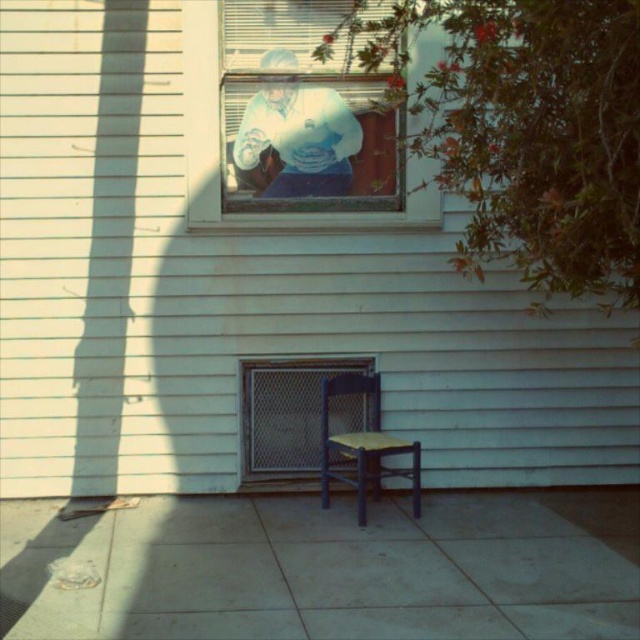
What do you see at coordinates (296, 141) in the screenshot? I see `white cotton shirt at upper center` at bounding box center [296, 141].

Is point (275, 124) positioned in front of point (348, 364)?

Yes, it is.

Identify the location of white cotton shirt at upper center. (x=296, y=141).

What do you see at coordinates (285, 416) in the screenshot? The height and width of the screenshot is (640, 640). I see `metal mesh door at lower center` at bounding box center [285, 416].

Measure the distance between metal mesh door at lower center and wooden chair at center.

They are 14.09 inches apart.

Is point (310, 404) farther from camera compared to point (340, 474)?

Yes, point (310, 404) is behind point (340, 474).

You are a GUI agent. You are given a task and a screenshot of the screen. Output one action in this format:
    pyautogui.click(x=<x>, y=<y>)
    Task: Click on the metal mesh door at lower center
    The height and width of the screenshot is (640, 640).
    Given the screenshot: What is the action you would take?
    pyautogui.click(x=285, y=416)

Is point (205, 147) behind point (257, 417)?

No, (205, 147) is closer to viewer.

Is clear glass window at upper center positioned in front of metal mesh door at lower center?

Yes, it is in front of metal mesh door at lower center.

Who is more distant from viewer, (424,205) or (316,404)?

The point (316,404) is behind.

Where is `clear glass window at upper center`? The image size is (640, 640). clear glass window at upper center is located at coordinates (218, 150).